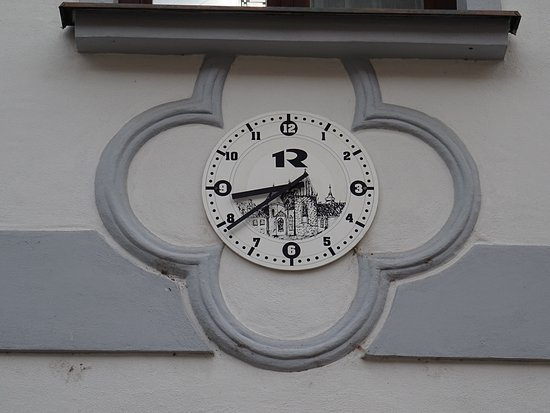
Identify the location of ledge. This screenshot has width=550, height=413. (422, 38).